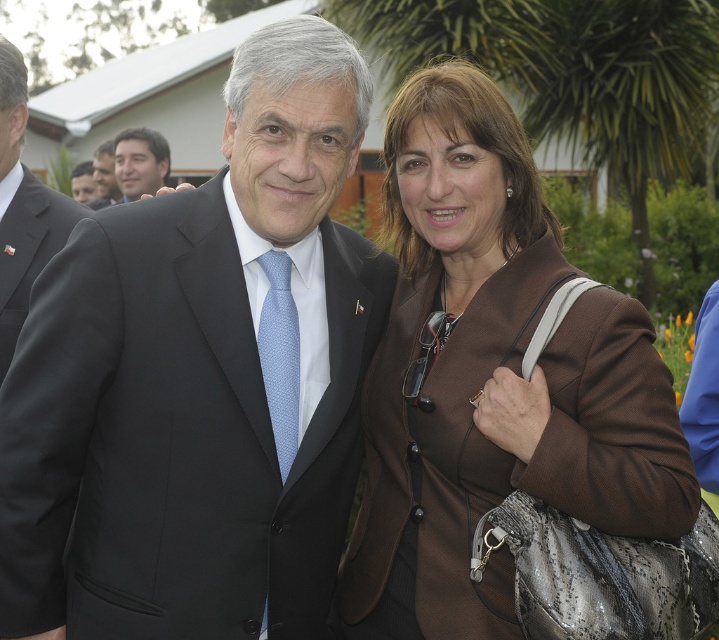
Does black smooth suit at center appear on the left side of brown textured jacket at center?

Yes, black smooth suit at center is to the left of brown textured jacket at center.

Can you confirm if black smooth suit at center is positioned below brown textured jacket at center?

Indeed, black smooth suit at center is positioned under brown textured jacket at center.

You are a GUI agent. You are given a task and a screenshot of the screen. Output one action in this format:
    pyautogui.click(x=<x>, y=<y>)
    Task: Click on the black smooth suit at center
    This screenshot has height=640, width=719.
    Given the screenshot: What is the action you would take?
    pyautogui.click(x=174, y=435)

Based on the photo, measure the distance between light blue textured tie at center and camera.

light blue textured tie at center and camera are 2.50 meters apart.

Who is positioned more to the right, light blue textured tie at center or matte black suit at center?

Positioned to the right is light blue textured tie at center.

The image size is (719, 640). I want to click on light blue textured tie at center, so click(279, 355).

Find the location of `light blue textured tie at center`. light blue textured tie at center is located at coordinates (279, 355).

What do you see at coordinates (22, 208) in the screenshot? This screenshot has height=640, width=719. I see `black suit at left` at bounding box center [22, 208].

Is black suit at left further to camera compared to light blue textured tie at center?

Yes, it is.

Describe the element at coordinates (22, 208) in the screenshot. I see `black suit at left` at that location.

Where is `black suit at left`? The image size is (719, 640). black suit at left is located at coordinates (22, 208).